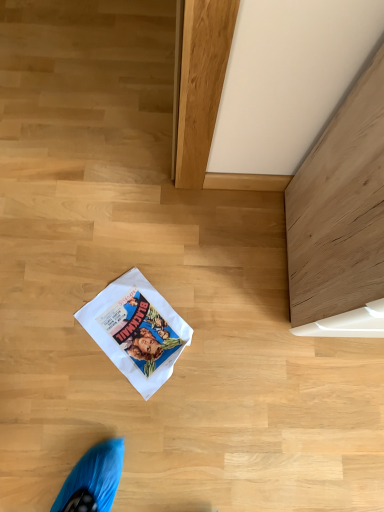
This screenshot has width=384, height=512. Identify the location of free space behind white paper comic book at center. (161, 252).